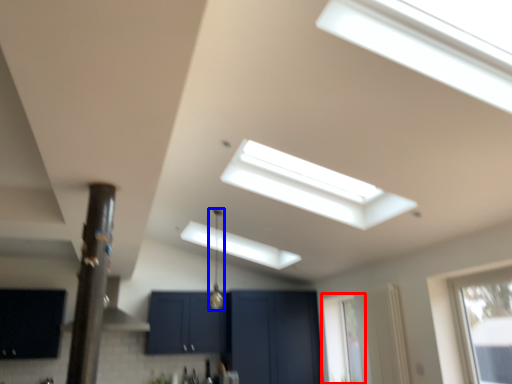
Question: Which object appears farthest to the camera in this image, window (highlighted by a red box) or light fixture (highlighted by a blue box)?

Choices:
 (A) window
 (B) light fixture

Answer: (A)